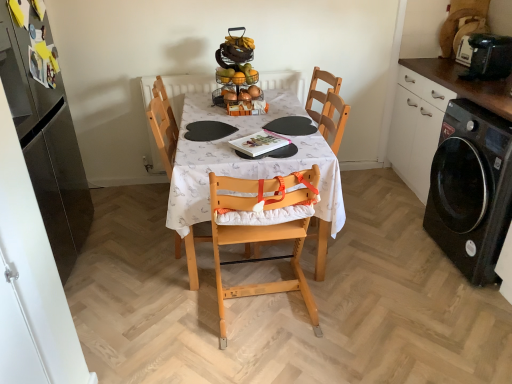
Question: Does black matte cabinet at right, which is counted as the 2th cabinetry, starting from the left, lie in front of white fabric table at center?

Choices:
 (A) yes
 (B) no

Answer: (A)

Question: Can you confirm if black matte cabinet at right, the first cabinetry from the right, is smaller than white fabric table at center?

Choices:
 (A) yes
 (B) no

Answer: (B)

Question: Is black matte cabinet at right, which is counted as the 2th cabinetry, starting from the left, aimed at white fabric table at center?

Choices:
 (A) yes
 (B) no

Answer: (A)

Question: Is black matte cabinet at right, the first cabinetry from the right, thinner than white fabric table at center?

Choices:
 (A) yes
 (B) no

Answer: (A)

Question: Is the surface of black matte cabinet at right, the first cabinetry from the right, in direct contact with white fabric table at center?

Choices:
 (A) no
 (B) yes

Answer: (A)

Question: Are black matte cabinet at right, the first cabinetry from the right, and white fabric table at center located far from each other?

Choices:
 (A) no
 (B) yes

Answer: (B)

Question: Is black matte cabinet at right, the first cabinetry from the right, next to light wood highchair at center, which is the 2th chair in left-to-right order?

Choices:
 (A) no
 (B) yes

Answer: (A)

Question: Considering the relative sizes of black matte cabinet at right, the first cabinetry from the right, and light wood highchair at center, which is the 2th chair in left-to-right order, in the image provided, is black matte cabinet at right, the first cabinetry from the right, smaller than light wood highchair at center, which is the 2th chair in left-to-right order,?

Choices:
 (A) no
 (B) yes

Answer: (A)

Question: Is black matte cabinet at right, which is counted as the 2th cabinetry, starting from the left, positioned in front of light wood highchair at center, the first chair viewed from the right?

Choices:
 (A) yes
 (B) no

Answer: (A)

Question: Is black matte cabinet at right, the first cabinetry from the right, oriented towards light wood highchair at center, which is the 2th chair in left-to-right order?

Choices:
 (A) no
 (B) yes

Answer: (B)

Question: Can you confirm if black matte cabinet at right, which is counted as the 2th cabinetry, starting from the left, is positioned to the left of light wood highchair at center, the first chair viewed from the right?

Choices:
 (A) no
 (B) yes

Answer: (A)

Question: Is the depth of black matte cabinet at right, which is counted as the 2th cabinetry, starting from the left, greater than that of light wood highchair at center, which is the 2th chair in left-to-right order?

Choices:
 (A) yes
 (B) no

Answer: (B)

Question: Does glossy stainless steel refrigerator at left, which appears as the second cabinetry when viewed from the right, appear on the left side of light wood highchair at center, which is the 2th chair in left-to-right order?

Choices:
 (A) no
 (B) yes

Answer: (B)